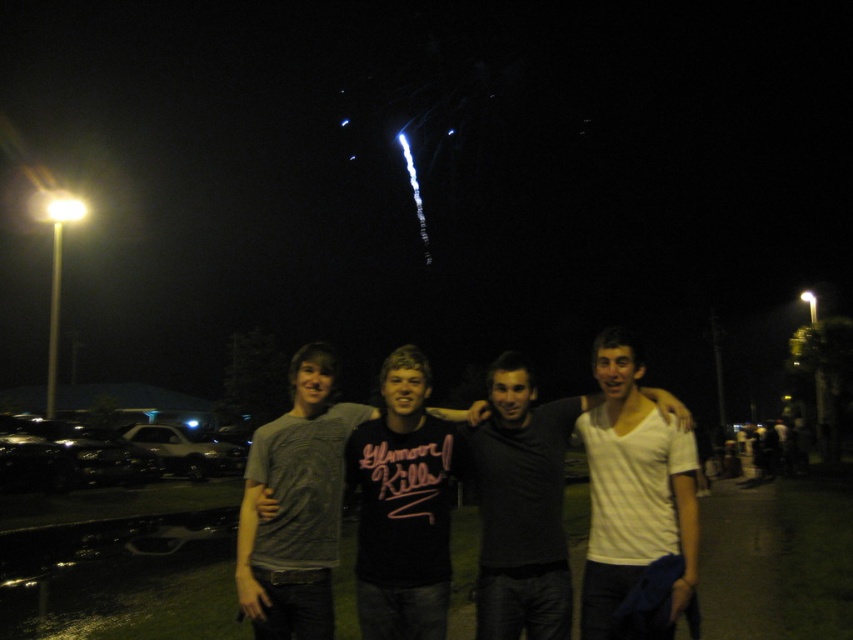
Question: Does white matte shirt at center appear under dark gray t-shirt at center?

Choices:
 (A) yes
 (B) no

Answer: (B)

Question: Does white matte shirt at center appear on the right side of dark gray t-shirt at center?

Choices:
 (A) yes
 (B) no

Answer: (A)

Question: Which of the following is the farthest from the observer?

Choices:
 (A) white matte shirt at center
 (B) dark gray t-shirt at center

Answer: (A)

Question: Which object appears farthest from the camera in this image?

Choices:
 (A) white matte shirt at center
 (B) dark gray t-shirt at center

Answer: (A)

Question: Which object appears closest to the camera in this image?

Choices:
 (A) dark gray t-shirt at center
 (B) white matte shirt at center

Answer: (A)

Question: Is white matte shirt at center closer to the viewer compared to dark gray t-shirt at center?

Choices:
 (A) yes
 (B) no

Answer: (B)